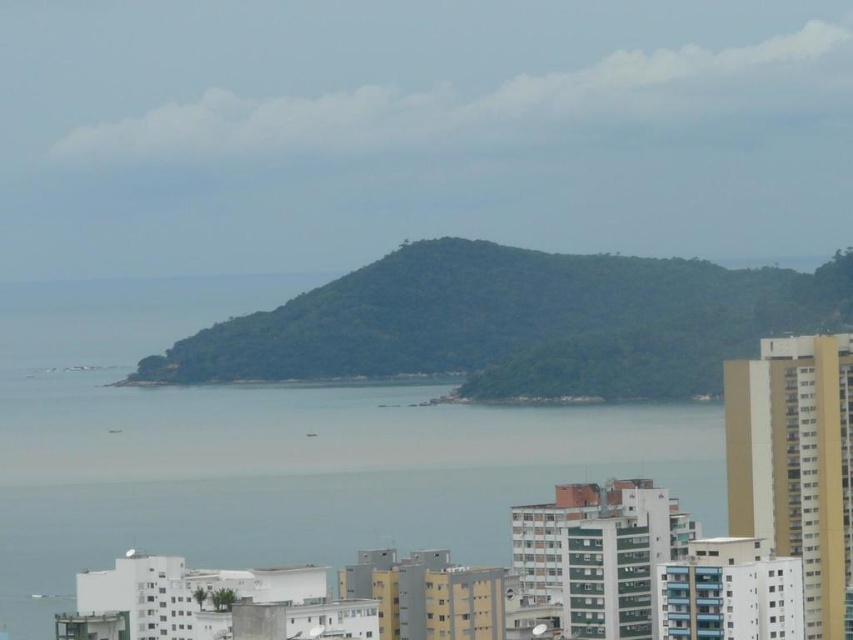
You are standing at point A and want to reach point B. The coordinates of point A are point A at (x=115, y=376) and point B are point B at (x=662, y=269). According to the image, which point is closer to you?

Point A at (x=115, y=376) is behind point B at (x=662, y=269), so point B is closer to you.

You are a drone operator planning to fly a drone from the residential buildings to capture aerial shots of the clear blue water at center and the green leafy hill at center. Considering the height differences between these two landmarks, which one would require adjusting the drone to a higher altitude to capture properly?

The clear blue water at center has a greater height compared to the green leafy hill at center. Therefore, to capture the clear blue water at center properly, the drone would need to be adjusted to a higher altitude than for the green leafy hill at center.